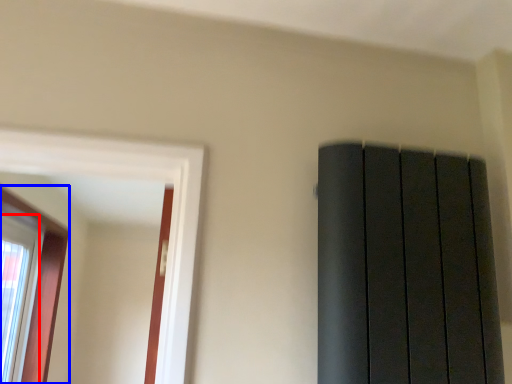
Question: Which object is further to the camera taking this photo, window (highlighted by a red box) or window (highlighted by a blue box)?

Choices:
 (A) window
 (B) window

Answer: (A)